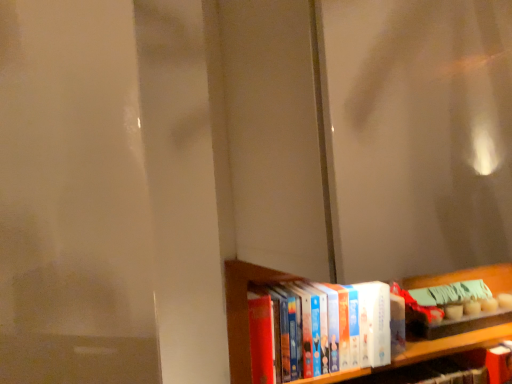
The image size is (512, 384). What do you see at coordinates (319, 330) in the screenshot?
I see `hardcover books at lower right` at bounding box center [319, 330].

Where is `hardcover books at lower right`? hardcover books at lower right is located at coordinates (319, 330).

Identify the location of hardcover books at lower right. This screenshot has width=512, height=384. (319, 330).